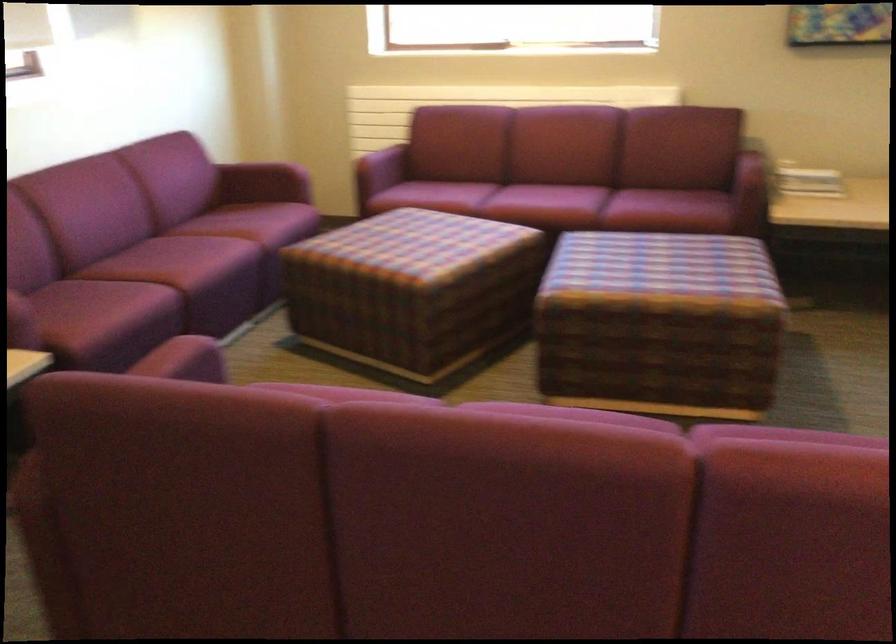
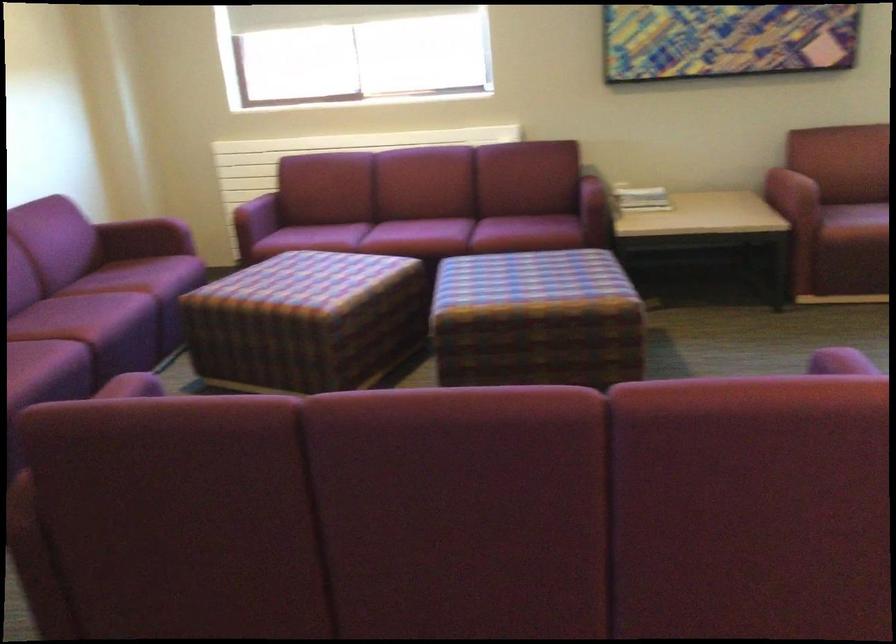
Locate, in the second image, the point that corresponds to pixel 804 184 in the first image.

(640, 198)